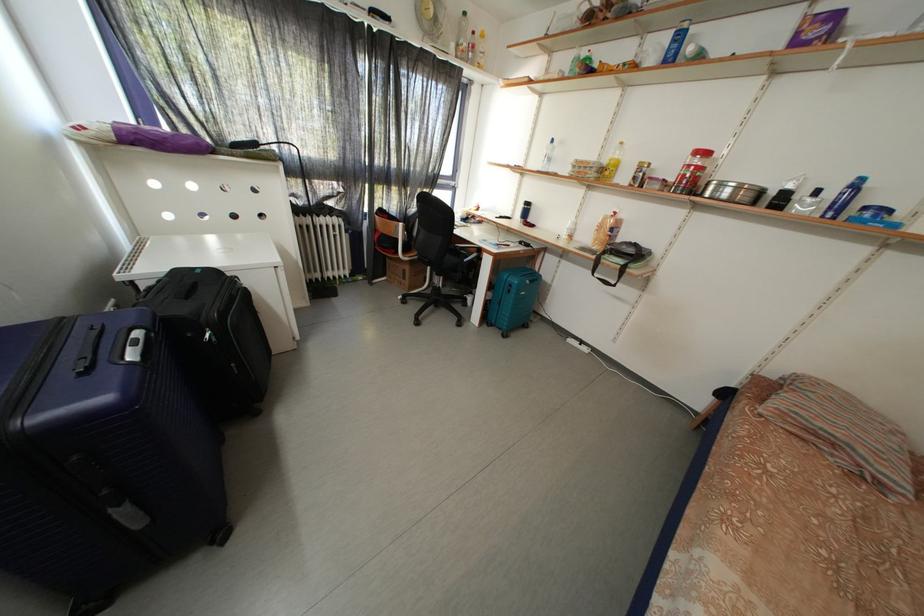
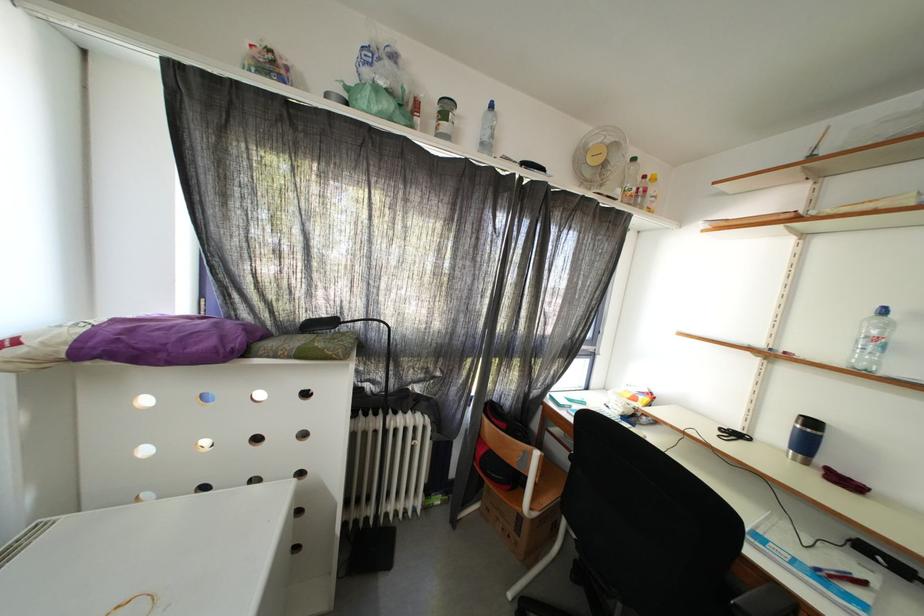
Find the pixel in the second image that matches (536,209) in the first image.

(820, 429)